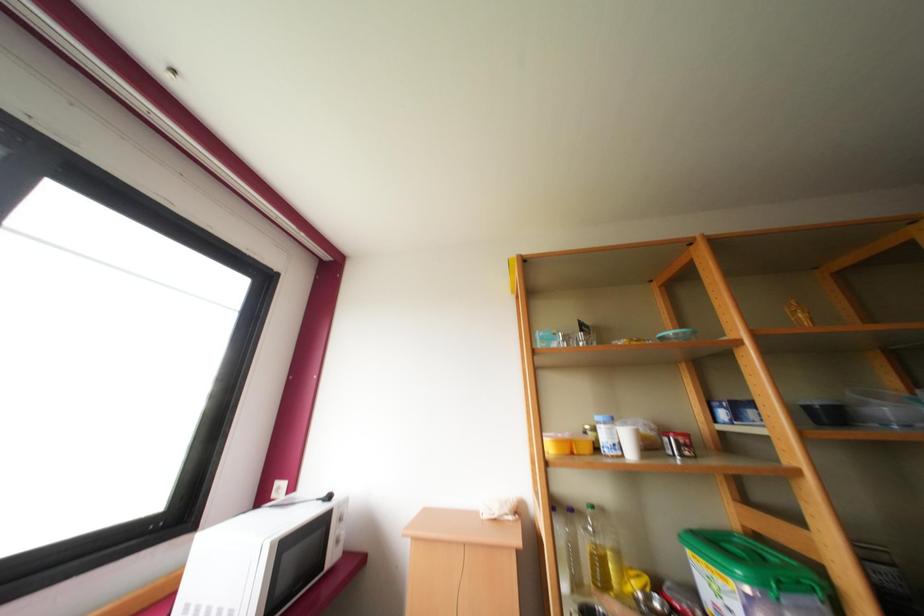
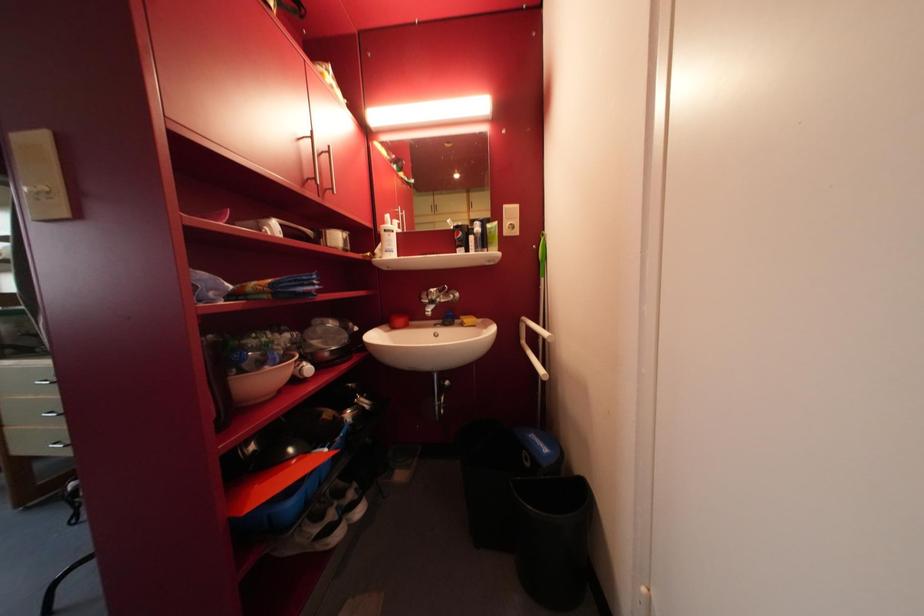
Question: What movement of the cameraman would produce the second image?

Choices:
 (A) Left
 (B) Right
 (C) Forward
 (D) Backward

Answer: (B)